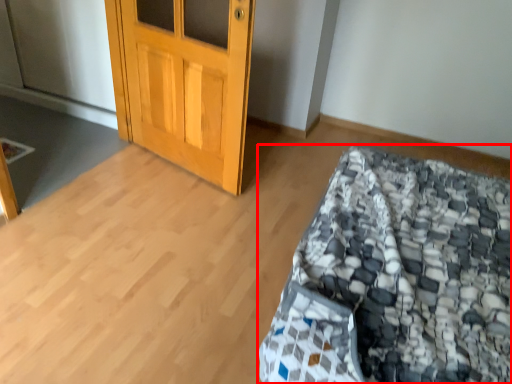
Question: Where is bed (annotated by the red box) located in relation to door in the image?

Choices:
 (A) left
 (B) right

Answer: (B)